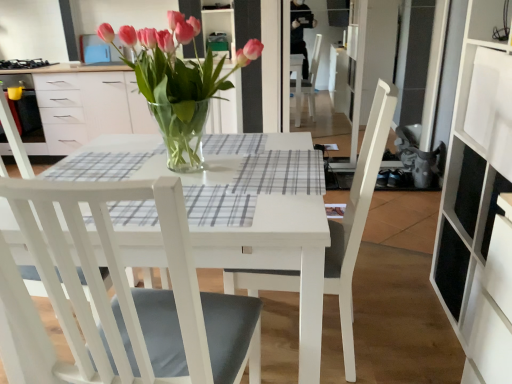
Question: Does point (172, 71) appear closer or farther from the camera than point (109, 190)?

Choices:
 (A) farther
 (B) closer

Answer: (A)

Question: From the image's perspective, is pink glass vase at center positioned above or below white matte chair at center, placed as the first chair when sorted from left to right?

Choices:
 (A) above
 (B) below

Answer: (A)

Question: Which is nearer to the white matte cabinet at right?

Choices:
 (A) white wood chair at center, acting as the 1th chair starting from the right
 (B) black matte gas stove at upper left
 (C) gray checkered placemat at center
 (D) white matte chair at center, placed as the first chair when sorted from left to right
 (E) pink glass vase at center

Answer: (A)

Question: Which is farther from the black matte gas stove at upper left?

Choices:
 (A) white matte cabinet at right
 (B) gray checkered placemat at center
 (C) white wood chair at center, placed as the 2th chair when sorted from left to right
 (D) pink glass vase at center
 (E) white matte chair at center, placed as the first chair when sorted from left to right

Answer: (A)